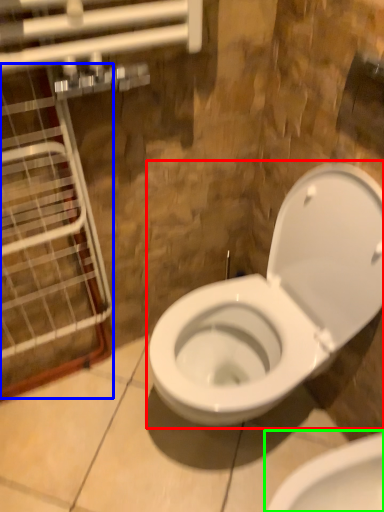
Question: Which object is positioned closest to toilet (highlighted by a red box)? Select from glass door (highlighted by a blue box) and toilet (highlighted by a green box).

Choices:
 (A) glass door
 (B) toilet

Answer: (B)